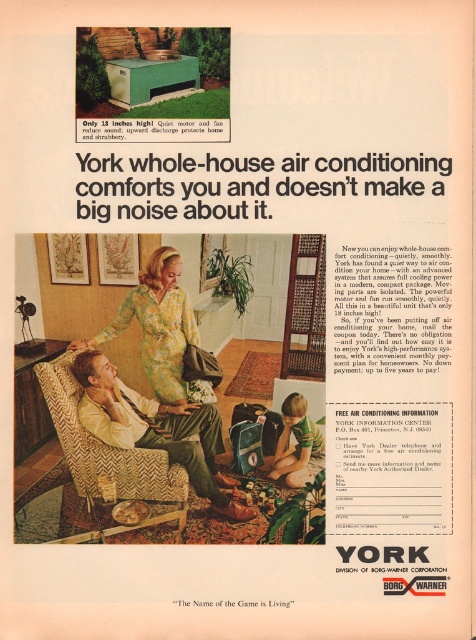
Question: Does herringbone fabric chair at lower left appear on the right side of green floral dress at center?

Choices:
 (A) yes
 (B) no

Answer: (B)

Question: Which point is farther to the camera?

Choices:
 (A) green floral dress at center
 (B) herringbone fabric chair at lower left

Answer: (A)

Question: Which object appears closest to the camera in this image?

Choices:
 (A) green floral dress at center
 (B) herringbone fabric chair at lower left

Answer: (B)

Question: Can you confirm if herringbone fabric chair at lower left is thinner than green floral dress at center?

Choices:
 (A) yes
 (B) no

Answer: (A)

Question: Does herringbone fabric chair at lower left appear on the left side of green floral dress at center?

Choices:
 (A) yes
 (B) no

Answer: (A)